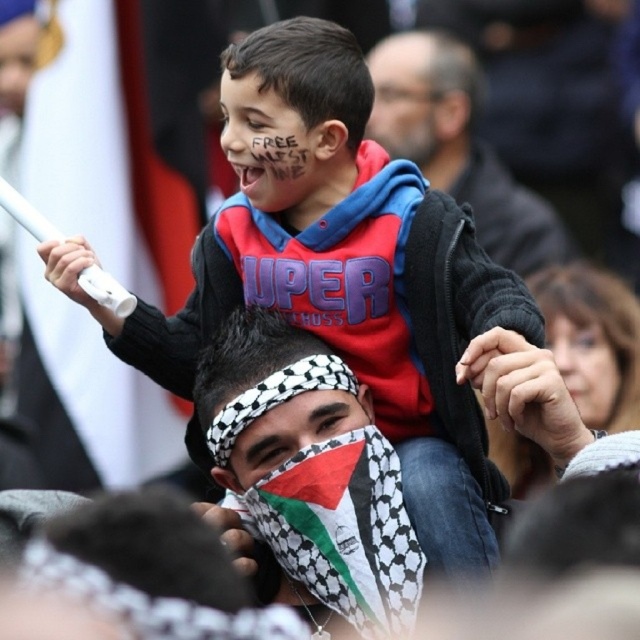
You are a photographer standing at the camera position. You need to capture a closeup shot of the matte black jacket at upper center. Given that the jacket is 188.31 feet away from you, what is the minimum focal length lens you would need to use to ensure the jacket fills the frame? Assume the camera sensor has a diagonal measurement of 24mm and the jacket itself measures 24 inches in length.

The matte black jacket at upper center is 188.31 feet away from the camera. To calculate the required focal length, use the formula focal length in mm equals sensor diagonal in mm multiplied by subject size in mm divided by distance from lens to subject in mm. Converting all measurements to millimeters, the jacket is 609.6 mm long, the distance is 57,378.7 mm, and the sensor diagonal is 24 mm. Plugging into the formula gives 24mm x 609.6mm divided by 57,378.7mm, resulting in approximately 0.258mm. Since no

You are a photographer trying to capture a clear photo of both the matte black jacket at upper center and the palestinian flag at center. Which object should you focus on first to ensure it appears sharp in the photo?

The matte black jacket at upper center is closer to you than the palestinian flag at center, so you should focus on the matte black jacket at upper center first to ensure it appears sharp in the photo.

You are standing at a distance of 60 meters from the scene. Can you see the point located at coordinates point (442,33) in the image?

The point located at coordinates point (442,33) is 66.42 meters away from the viewer. Since you are standing at 60 meters, you are closer than the point, so you can see it.